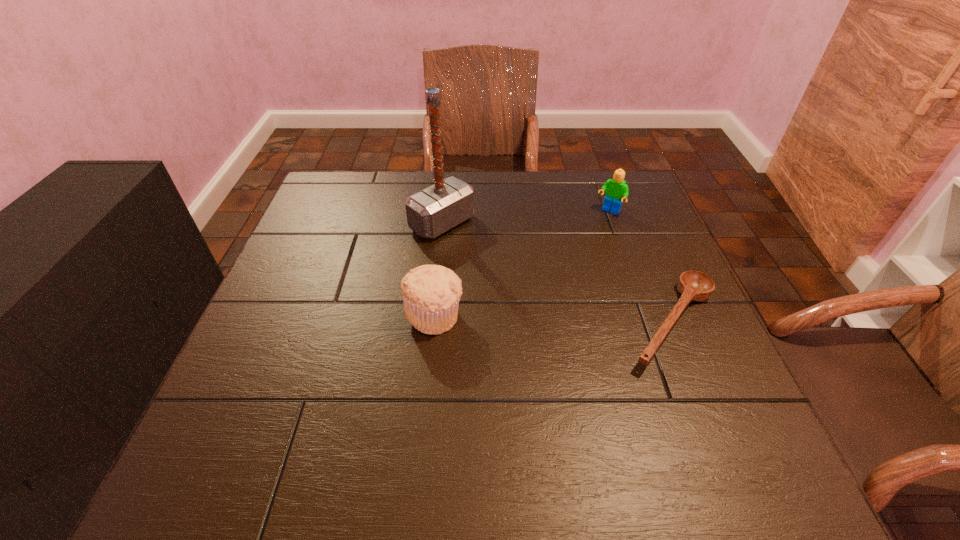
Locate an element on the screen. This screenshot has width=960, height=540. muffin is located at coordinates (431, 293).

Image resolution: width=960 pixels, height=540 pixels. Identify the location of the shortest object. (693, 285).

What are the coordinates of `hammer` in the screenshot? It's located at (432, 211).

Where is `Lego`? The image size is (960, 540). Lego is located at coordinates pos(616,189).

This screenshot has height=540, width=960. Find the location of `free space located 0.150m on the left of the muffin`. free space located 0.150m on the left of the muffin is located at coordinates (336, 315).

You are a GUI agent. You are given a task and a screenshot of the screen. Output one action in this format:
    pyautogui.click(x=<x>, y=<y>)
    Task: Click on the vacant space situated 0.300m on the left of the wooden spoon
    This screenshot has width=960, height=540.
    Given the screenshot: What is the action you would take?
    pyautogui.click(x=479, y=323)

Locate an element on the screen. vacant space situated 0.330m on the striking surface of the hammer is located at coordinates (565, 305).

Image resolution: width=960 pixels, height=540 pixels. Identify the location of free space located 0.190m on the striking surface of the hammer. (518, 274).

Where is `vacant area situated 0.130m on the striking surface of the hammer`? vacant area situated 0.130m on the striking surface of the hammer is located at coordinates (500, 261).

At what (x,y) coordinates should I click in order to perform the action: click on blank space located on the face of the Lego. Please return your answer as a coordinate pair (x, y). The height and width of the screenshot is (540, 960). Looking at the image, I should click on [561, 272].